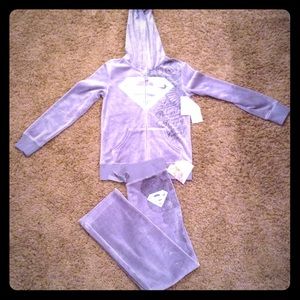
Locate an element on the screen. carpet is located at coordinates (235, 36).